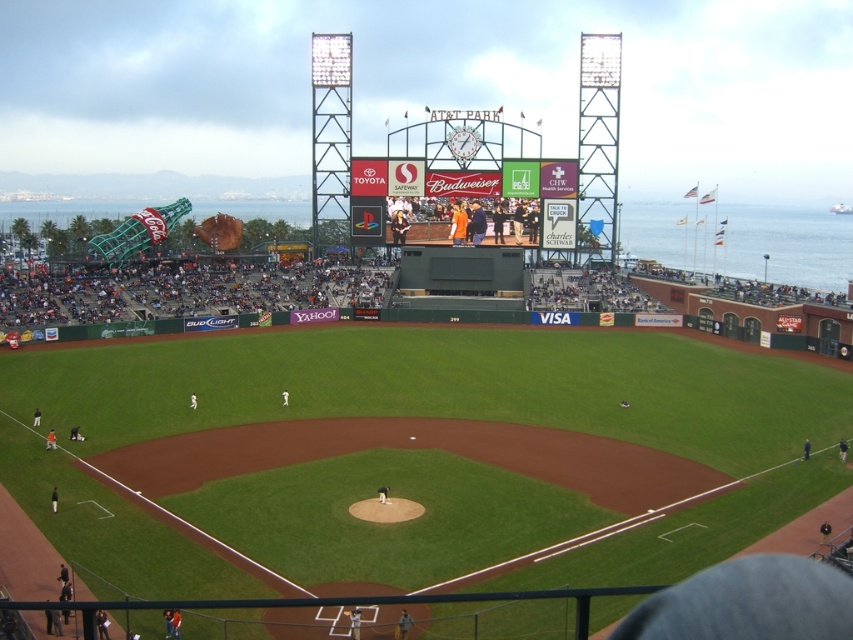
Question: Is green grass at center above matte digital screen at center?

Choices:
 (A) no
 (B) yes

Answer: (A)

Question: Which point is closer to the camera?

Choices:
 (A) (532, 237)
 (B) (508, 189)

Answer: (B)

Question: Does matte digital screen at center appear under orange jersey at center?

Choices:
 (A) yes
 (B) no

Answer: (B)

Question: In this image, where is matte digital screen at center located relative to orange jersey at center?

Choices:
 (A) right
 (B) left

Answer: (A)

Question: Which point is closer to the camera taking this photo?

Choices:
 (A) (558, 365)
 (B) (375, 173)
 (C) (416, 234)

Answer: (A)

Question: Which point appears farthest from the camera in this image?

Choices:
 (A) (496, 230)
 (B) (785, 490)

Answer: (A)